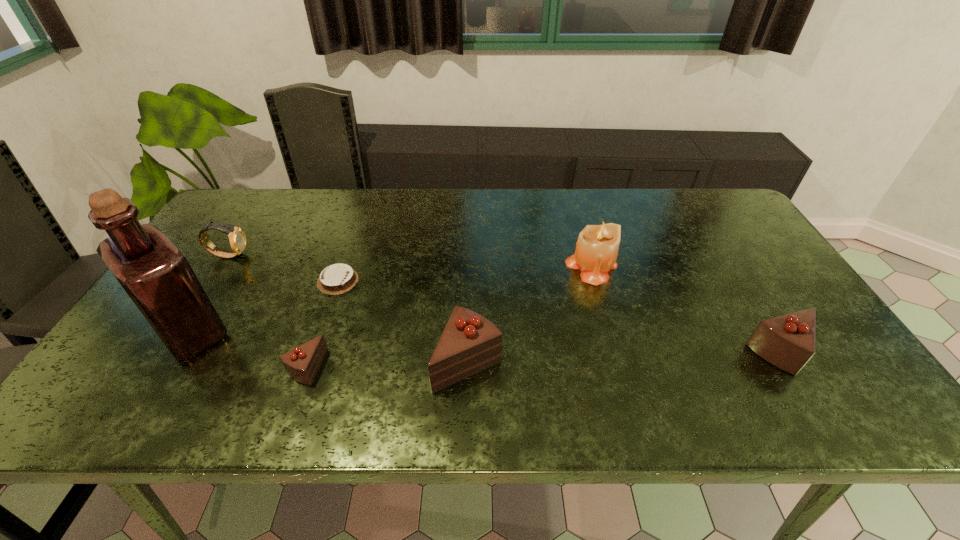
Image resolution: width=960 pixels, height=540 pixels. I want to click on object at the right edge, so click(788, 342).

The width and height of the screenshot is (960, 540). Identify the location of object that is positioned at the near left corner. (157, 277).

This screenshot has width=960, height=540. Find the location of `object located at the near right corner`. object located at the near right corner is located at coordinates (788, 342).

At what (x,y) coordinates should I click in order to perform the action: click on vacant point at the far edge. Please return your answer as a coordinate pair (x, y). The width and height of the screenshot is (960, 540). Looking at the image, I should click on (478, 205).

This screenshot has width=960, height=540. Identify the location of free space at the near edge. (363, 380).

Where is `vacant point at the right edge`? vacant point at the right edge is located at coordinates (742, 247).

At what (x,y) coordinates should I click in order to perform the action: click on vacant point at the far left corner. Please return your answer as a coordinate pair (x, y). Looking at the image, I should click on (255, 212).

The height and width of the screenshot is (540, 960). I want to click on vacant space at the near left corner of the desktop, so pyautogui.click(x=178, y=362).

Locate an element on the screen. Image resolution: width=960 pixels, height=540 pixels. vacant space in between the candle and the third tallest chocolate cake is located at coordinates (448, 316).

Image resolution: width=960 pixels, height=540 pixels. What are the coordinates of `free spot between the farthest chocolate cake and the watch` in the screenshot? It's located at (283, 268).